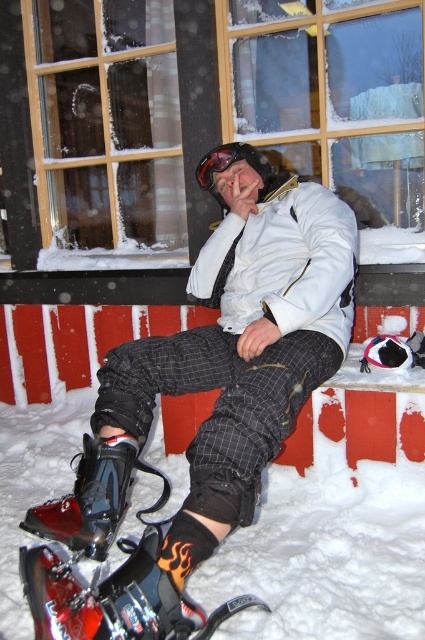
Which is more to the right, flame-patterned plastic snowshoe at lower left or glossy black ski boot at lower left?

flame-patterned plastic snowshoe at lower left is more to the right.

Is point (150, 570) in front of point (90, 508)?

Yes, point (150, 570) is closer to viewer.

Where is `flame-patterned plastic snowshoe at lower left`? flame-patterned plastic snowshoe at lower left is located at coordinates (116, 598).

Is matte black snowboard at center to the right of glossy plastic goggles at center from the viewer's perspective?

No, matte black snowboard at center is not to the right of glossy plastic goggles at center.

Is matte black snowboard at center smaller than glossy plastic goggles at center?

Actually, matte black snowboard at center might be larger than glossy plastic goggles at center.

At what (x,y) coordinates should I click in order to perform the action: click on matte black snowboard at center. Please return your answer as a coordinate pair (x, y). The image size is (425, 640). Looking at the image, I should click on 212,408.

The image size is (425, 640). What do you see at coordinates (212, 408) in the screenshot?
I see `matte black snowboard at center` at bounding box center [212, 408].

Where is `matte black snowboard at center`? This screenshot has height=640, width=425. matte black snowboard at center is located at coordinates (212, 408).